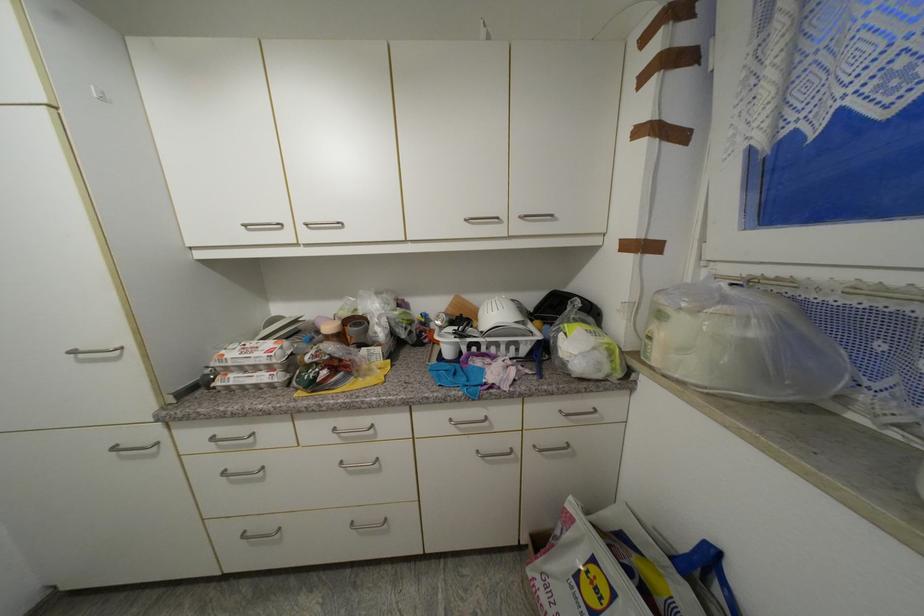
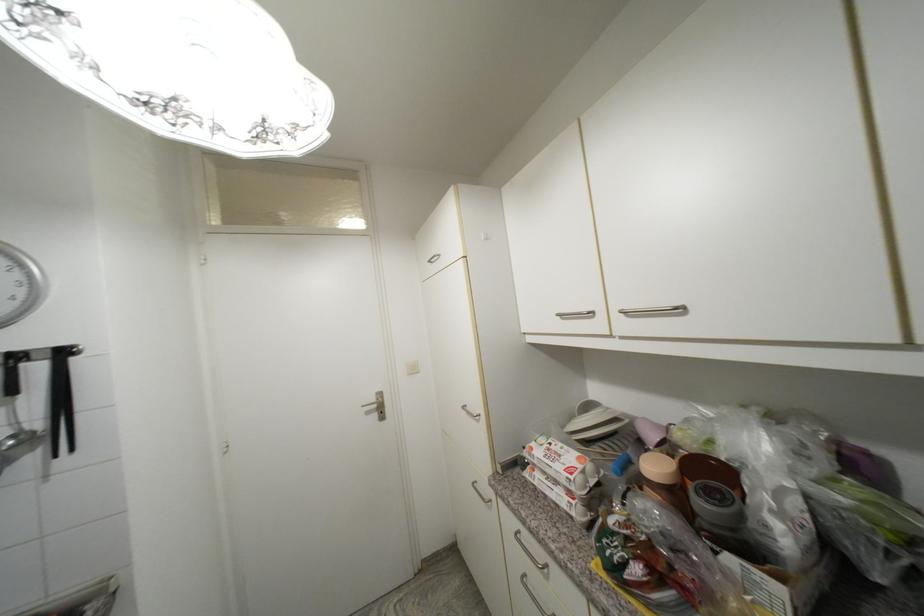
Question: The images are taken continuously from a first-person perspective. In which direction is your viewpoint rotating?

Choices:
 (A) Left
 (B) Right
 (C) Up
 (D) Down

Answer: (A)